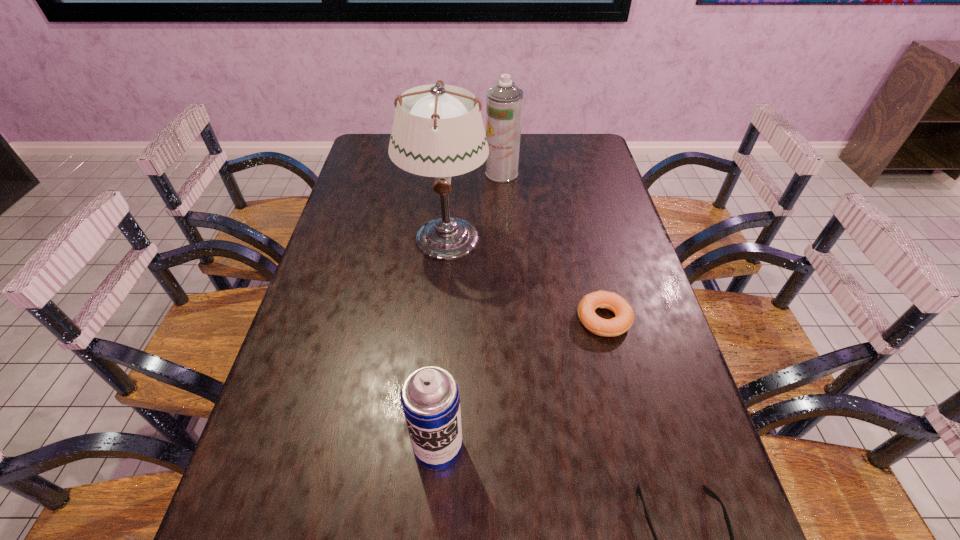
Locate an element on the screen. vacant space located on the front of the third nearest object is located at coordinates (617, 374).

Where is `object located at the far edge`? Image resolution: width=960 pixels, height=540 pixels. object located at the far edge is located at coordinates (504, 103).

This screenshot has width=960, height=540. I want to click on object situated at the right edge, so click(624, 315).

Locate an element on the screen. vacant region at the far edge is located at coordinates (554, 148).

Locate an element on the screen. vacant space at the left edge of the desktop is located at coordinates (296, 443).

The width and height of the screenshot is (960, 540). I want to click on free location at the right edge, so click(x=640, y=476).

This screenshot has height=540, width=960. Identify the location of free space at the far left corner of the desktop. (385, 140).

The width and height of the screenshot is (960, 540). I want to click on vacant space at the far right corner of the desktop, so click(x=568, y=134).

At what (x,y) coordinates should I click in order to perform the action: click on free space between the third farthest object and the left aerosol can. Please return your answer as a coordinate pair (x, y). This screenshot has height=540, width=960. Looking at the image, I should click on (520, 383).

Image resolution: width=960 pixels, height=540 pixels. I want to click on free space between the tallest object and the nearer aerosol can, so coord(442,342).